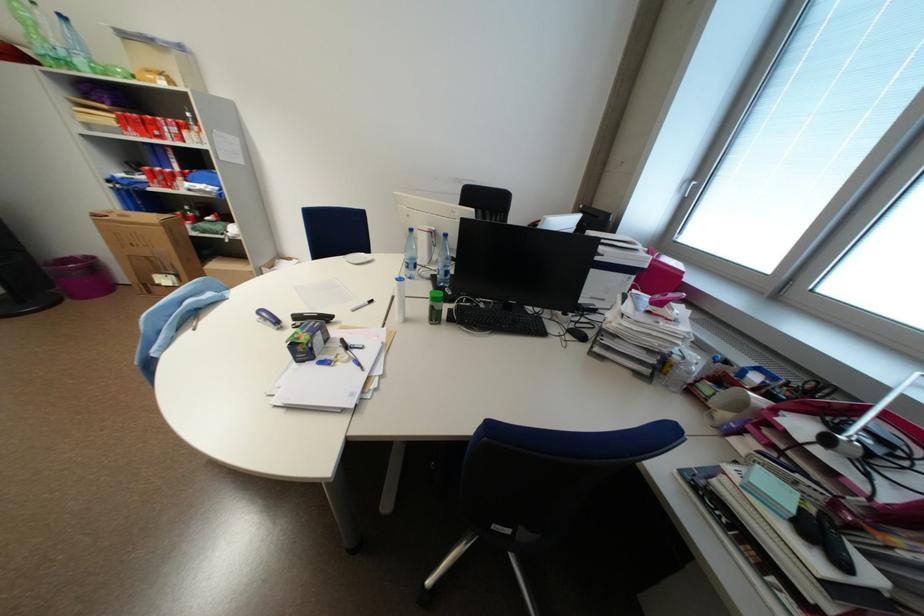
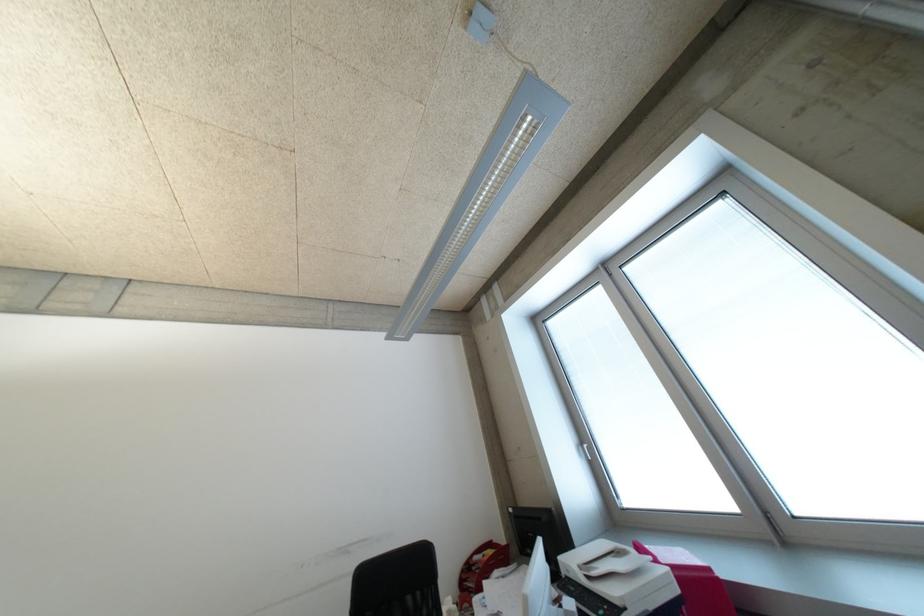
Locate, in the second image, the point that corresponds to (x=654, y=268) in the first image.

(687, 591)